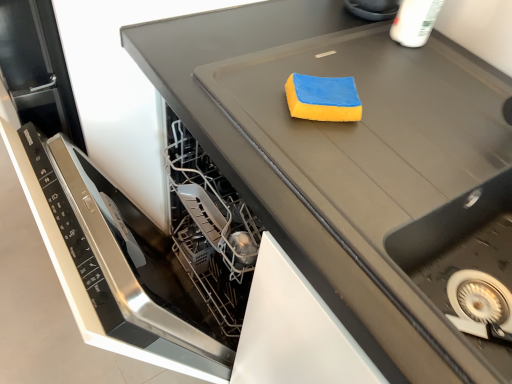
This screenshot has width=512, height=384. I want to click on unoccupied area behind blue sponge at center, so click(x=342, y=53).